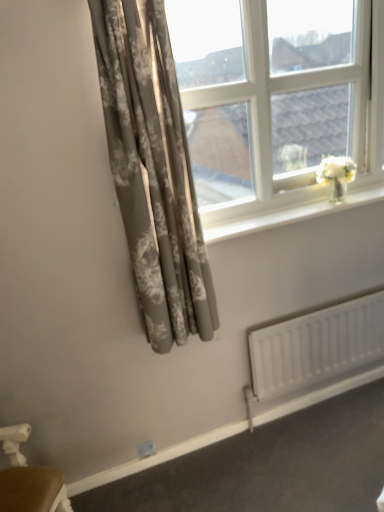
Describe the element at coordinates (291, 215) in the screenshot. This screenshot has width=384, height=512. I see `white glossy window sill at upper center` at that location.

I want to click on matte gray floral curtain at left, so click(x=153, y=170).

The width and height of the screenshot is (384, 512). What are the coordinates of `white glossy window sill at upper center` in the screenshot? It's located at (291, 215).

Which is in front, white matte radiator at lower right or clear glass window at upper right?

clear glass window at upper right.

How many degrees apart are the facing directions of white matte radiator at lower right and clear glass window at upper right?

The angular difference between white matte radiator at lower right and clear glass window at upper right is 0.324 degrees.

Is white matte radiator at lower right taller or shorter than clear glass window at upper right?

white matte radiator at lower right is shorter than clear glass window at upper right.

Which is correct: white glossy window sill at upper center is inside matte gray floral curtain at left, or outside of it?

white glossy window sill at upper center is located beyond the bounds of matte gray floral curtain at left.

Which is nearer, (x=379, y=195) or (x=120, y=31)?

Point (x=120, y=31)

Does white glossy window sill at upper center touch matte gray floral curtain at left?

No, white glossy window sill at upper center is not with matte gray floral curtain at left.

How much distance is there between white matte radiator at lower right and white glossy window sill at upper center?

white matte radiator at lower right is 23.75 inches from white glossy window sill at upper center.

From the image's perspective, is white matte radiator at lower right positioned above or below white glossy window sill at upper center?

white matte radiator at lower right is below white glossy window sill at upper center.

Does white matte radiator at lower right have a smaller size compared to white glossy window sill at upper center?

Incorrect, white matte radiator at lower right is not smaller in size than white glossy window sill at upper center.

Is white glossy window sill at upper center located within white matte radiator at lower right?

Actually, white glossy window sill at upper center is outside white matte radiator at lower right.

Does matte gray floral curtain at left come in front of white glossy window sill at upper center?

Yes, matte gray floral curtain at left is closer to the viewer.

Between matte gray floral curtain at left and white glossy window sill at upper center, which one appears on the right side from the viewer's perspective?

white glossy window sill at upper center is more to the right.

Where is `curtain on the left of white glossy window sill at upper center`? The height and width of the screenshot is (512, 384). curtain on the left of white glossy window sill at upper center is located at coordinates 153,170.

Considering the relative sizes of matte gray floral curtain at left and white glossy window sill at upper center in the image provided, is matte gray floral curtain at left wider than white glossy window sill at upper center?

Indeed, matte gray floral curtain at left has a greater width compared to white glossy window sill at upper center.

Which of these two, clear glass window at upper right or white matte radiator at lower right, is thinner?

white matte radiator at lower right is thinner.

Looking at this image, between clear glass window at upper right and white matte radiator at lower right, which one is positioned behind?

white matte radiator at lower right is further from the camera.

How distant is clear glass window at upper right from white matte radiator at lower right?

They are 33.53 inches apart.

Does clear glass window at upper right have a smaller size compared to white glossy window sill at upper center?

No.

Locate an element on the screen. The height and width of the screenshot is (512, 384). window sill located below the clear glass window at upper right (from the image's perspective) is located at coordinates (291, 215).

Is clear glass window at upper right positioned with its back to white glossy window sill at upper center?

No, clear glass window at upper right is not facing the opposite direction of white glossy window sill at upper center.

Is clear glass window at upper right spatially inside white glossy window sill at upper center, or outside of it?

The correct answer is: outside.

From the image's perspective, which one is positioned lower, clear glass window at upper right or matte gray floral curtain at left?

From the image's view, matte gray floral curtain at left is below.

In terms of size, does clear glass window at upper right appear bigger or smaller than matte gray floral curtain at left?

In the image, clear glass window at upper right appears to be larger than matte gray floral curtain at left.

Considering the sizes of clear glass window at upper right and matte gray floral curtain at left in the image, is clear glass window at upper right taller or shorter than matte gray floral curtain at left?

clear glass window at upper right is shorter than matte gray floral curtain at left.

Find the location of a particular element. The width and height of the screenshot is (384, 512). window on the left of white matte radiator at lower right is located at coordinates (277, 97).

Identify the location of curtain above the white glossy window sill at upper center (from the image's perspective). The image size is (384, 512). (153, 170).

Based on their spatial positions, is white glossy window sill at upper center or matte gray floral curtain at left closer to white matte radiator at lower right?

white glossy window sill at upper center lies closer to white matte radiator at lower right than the other object.

Considering their positions, is white matte radiator at lower right positioned further to clear glass window at upper right than matte gray floral curtain at left?

Among the two, white matte radiator at lower right is located further to clear glass window at upper right.

Considering their positions, is white glossy window sill at upper center positioned closer to matte gray floral curtain at left than clear glass window at upper right?

Based on the image, white glossy window sill at upper center appears to be nearer to matte gray floral curtain at left.

Which object lies nearer to the anchor point clear glass window at upper right, white glossy window sill at upper center or white matte radiator at lower right?

Based on the image, white glossy window sill at upper center appears to be nearer to clear glass window at upper right.

From the picture: When comparing their distances from matte gray floral curtain at left, does white matte radiator at lower right or clear glass window at upper right seem further?

Based on the image, white matte radiator at lower right appears to be further to matte gray floral curtain at left.

In the scene shown: Looking at the image, which one is located closer to clear glass window at upper right, white matte radiator at lower right or white glossy window sill at upper center?

Based on the image, white glossy window sill at upper center appears to be nearer to clear glass window at upper right.

Based on their spatial positions, is matte gray floral curtain at left or clear glass window at upper right further from white matte radiator at lower right?

clear glass window at upper right is further to white matte radiator at lower right.

From the image, which object appears to be farther from clear glass window at upper right, white glossy window sill at upper center or matte gray floral curtain at left?

matte gray floral curtain at left.

The width and height of the screenshot is (384, 512). Find the location of `window sill between clear glass window at upper right and white matte radiator at lower right in the vertical direction`. window sill between clear glass window at upper right and white matte radiator at lower right in the vertical direction is located at coordinates (291, 215).

In order to click on window sill that lies between matte gray floral curtain at left and white matte radiator at lower right from top to bottom in this screenshot , I will do `click(291, 215)`.

Identify the location of curtain that lies between clear glass window at upper right and white matte radiator at lower right from top to bottom. This screenshot has width=384, height=512. (153, 170).

Find the location of a particular element. window situated between matte gray floral curtain at left and white glossy window sill at upper center from left to right is located at coordinates (277, 97).